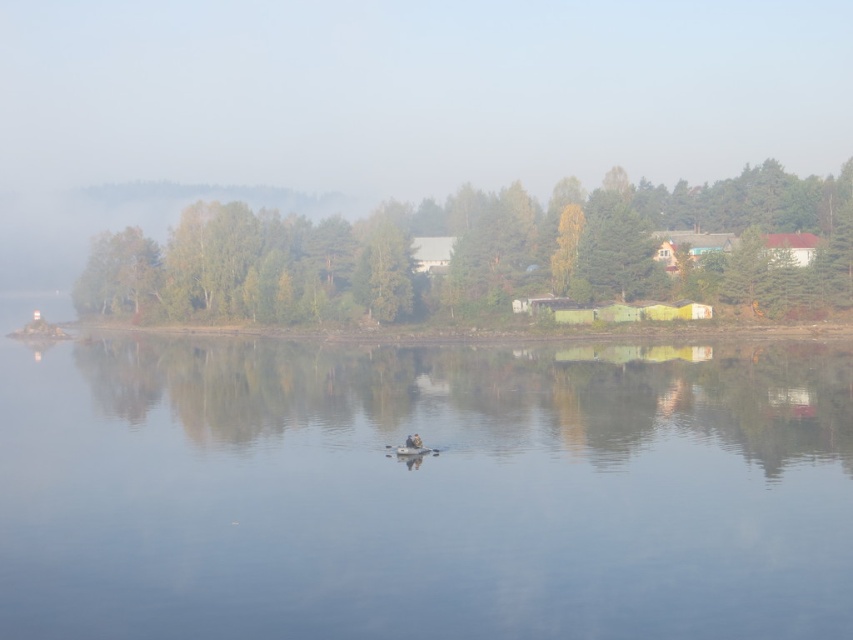
Question: Considering the relative positions of green matte tree at center and white plastic boat at center in the image provided, where is green matte tree at center located with respect to white plastic boat at center?

Choices:
 (A) right
 (B) left

Answer: (A)

Question: Is green matte tree at center smaller than white plastic boat at center?

Choices:
 (A) yes
 (B) no

Answer: (B)

Question: Which object appears closest to the camera in this image?

Choices:
 (A) green matte tree at center
 (B) white plastic boat at center
 (C) transparent water at center

Answer: (C)

Question: Based on their relative distances, which object is nearer to the transparent water at center?

Choices:
 (A) white plastic boat at center
 (B) green matte tree at center

Answer: (A)

Question: Which point appears farthest from the camera in this image?

Choices:
 (A) (0, 371)
 (B) (695, 273)

Answer: (B)

Question: Is transparent water at center smaller than green matte tree at center?

Choices:
 (A) no
 (B) yes

Answer: (B)